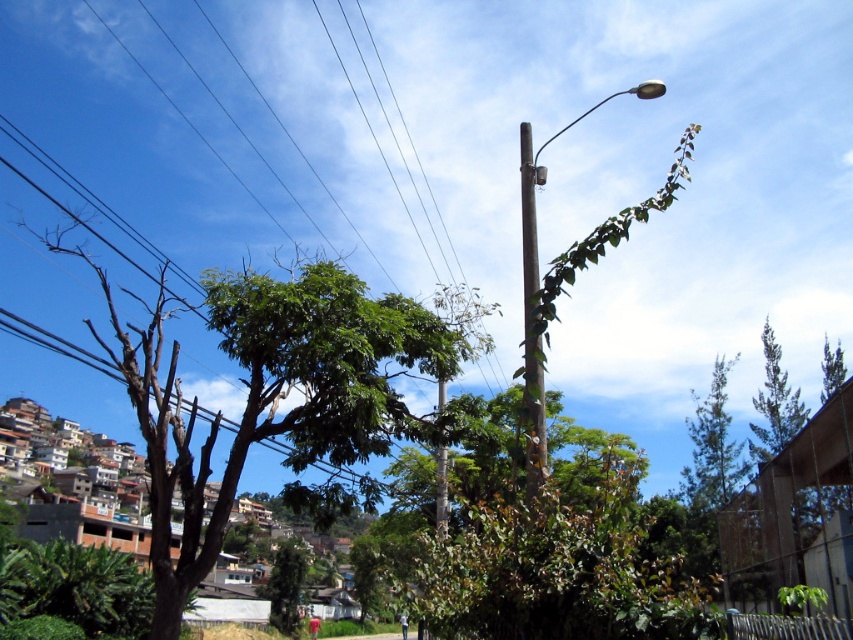
Which is below, brown wooden telegraph pole at center or green leafy tree at lower center?

Positioned lower is green leafy tree at lower center.

Between brown wooden telegraph pole at center and green leafy tree at lower center, which one appears on the right side from the viewer's perspective?

brown wooden telegraph pole at center

Is point (532, 326) positioned behind point (277, 566)?

No.

The width and height of the screenshot is (853, 640). Identify the location of brown wooden telegraph pole at center. (531, 323).

Does green leafy tree at left appear on the right side of green leafy tree at lower center?

Indeed, green leafy tree at left is positioned on the right side of green leafy tree at lower center.

Looking at this image, who is more distant from viewer, (401, 349) or (292, 604)?

The point (292, 604) is more distant.

Which is behind, point (457, 333) or point (264, 588)?

The point (264, 588) is more distant.

Locate an element on the screen. green leafy tree at left is located at coordinates (279, 394).

Can you confirm if metallic pole at upper right is positioned below green leafy tree at lower center?

Actually, metallic pole at upper right is above green leafy tree at lower center.

Is point (663, 92) closer to camera compared to point (270, 589)?

That is True.

Where is `metallic pole at upper right`? This screenshot has height=640, width=853. metallic pole at upper right is located at coordinates (538, 288).